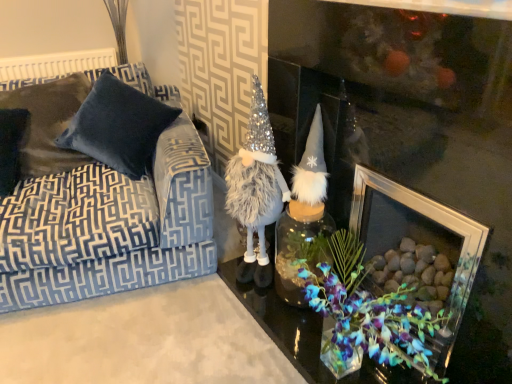
Question: From the image's perspective, relative to fuzzy silver/grey gnome at center, is velvet pillow at left, which is the 1th pillow in left-to-right order, above or below?

Choices:
 (A) below
 (B) above

Answer: (B)

Question: Considering the positions of velvet pillow at left, which is the 1th pillow in left-to-right order, and fuzzy silver/grey gnome at center in the image, is velvet pillow at left, which is the 1th pillow in left-to-right order, taller or shorter than fuzzy silver/grey gnome at center?

Choices:
 (A) tall
 (B) short

Answer: (B)

Question: Which object is the closest to the velvet blue couch at left?

Choices:
 (A) velvet pillow at left, positioned as the 2th pillow in right-to-left order
 (B) fuzzy silver/grey gnome at center
 (C) clear glass picture frame at center
 (D) velvet dark blue pillow at left, the first pillow positioned from the right
 (E) translucent glass jar at center

Answer: (D)

Question: Which object is positioned closest to the fuzzy silver/grey gnome at center?

Choices:
 (A) translucent glass jar at center
 (B) velvet dark blue pillow at left, the first pillow positioned from the right
 (C) velvet blue couch at left
 (D) velvet pillow at left, positioned as the 2th pillow in right-to-left order
 (E) clear glass picture frame at center

Answer: (A)